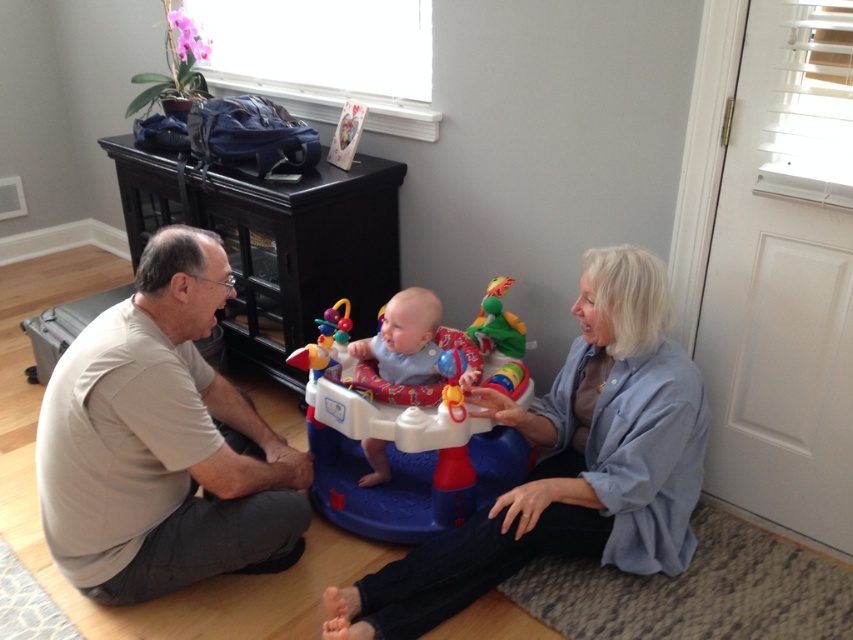
Question: Estimate the real-world distances between objects in this image. Which object is farther from the blue fabric baby at center?

Choices:
 (A) blue cotton shirt at center
 (B) blue plastic baby walker at center
 (C) light beige t-shirt at left

Answer: (C)

Question: Can you confirm if blue cotton shirt at center is positioned to the right of blue plastic baby walker at center?

Choices:
 (A) no
 (B) yes

Answer: (B)

Question: Does blue cotton shirt at center appear under blue fabric baby at center?

Choices:
 (A) no
 (B) yes

Answer: (B)

Question: Which object is the closest to the blue cotton shirt at center?

Choices:
 (A) blue fabric baby at center
 (B) light beige t-shirt at left

Answer: (A)

Question: Is blue plastic baby walker at center smaller than blue fabric baby at center?

Choices:
 (A) no
 (B) yes

Answer: (A)

Question: Among these objects, which one is farthest from the camera?

Choices:
 (A) light beige t-shirt at left
 (B) blue plastic baby walker at center

Answer: (B)